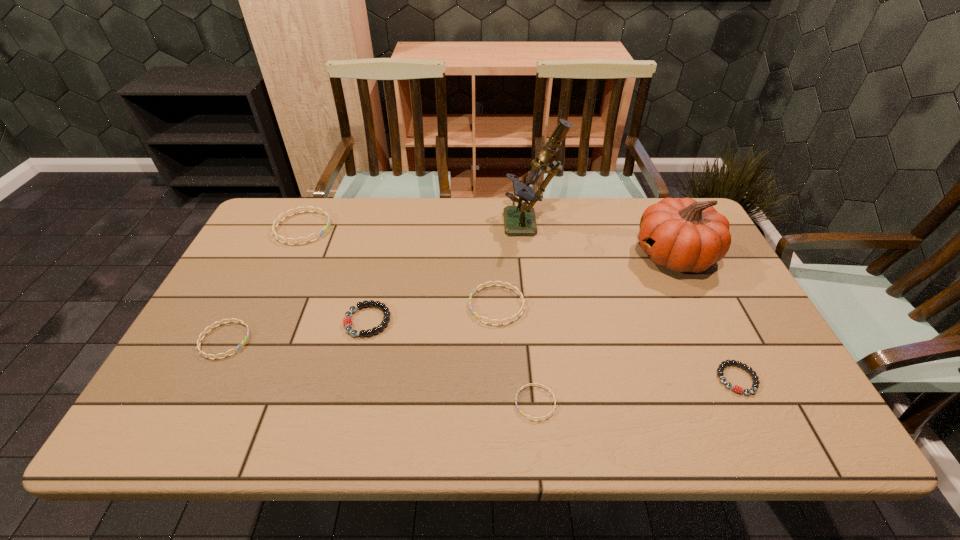
At what (x,y) coordinates should I click in order to perform the action: click on microscope. Please return your answer as a coordinate pair (x, y). This screenshot has height=540, width=960. Looking at the image, I should click on (518, 220).

You are a GUI agent. You are given a task and a screenshot of the screen. Output one action in this format:
    pyautogui.click(x=<x>, y=<y>)
    Task: Click on the brown microscope
    The width and height of the screenshot is (960, 540).
    Given the screenshot: What is the action you would take?
    pyautogui.click(x=518, y=220)

Find the location of `pumpkin`. pumpkin is located at coordinates (683, 235).

Identify the location of orange pumpkin. (683, 235).

Where is `the third tallest object`? the third tallest object is located at coordinates (277, 237).

In order to click on the farthest bracelet in this screenshot , I will do (277, 237).

Locate an element on the screen. the second biggest blue bracelet is located at coordinates (519, 293).

Image resolution: width=960 pixels, height=540 pixels. I want to click on the bigger black bracelet, so click(347, 321).

Where is `the left black bracelet`? the left black bracelet is located at coordinates (347, 321).

I want to click on the second smallest blue bracelet, so click(x=199, y=340).